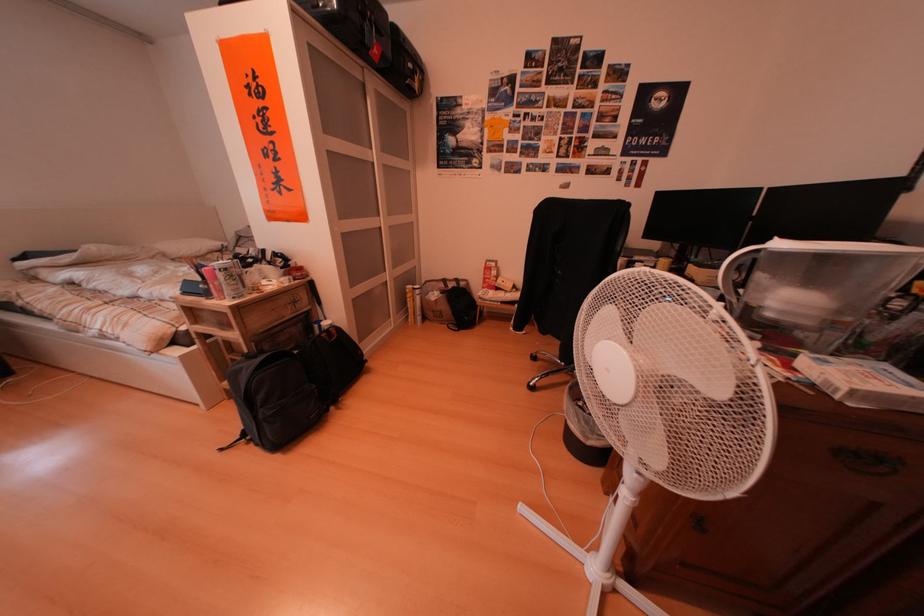
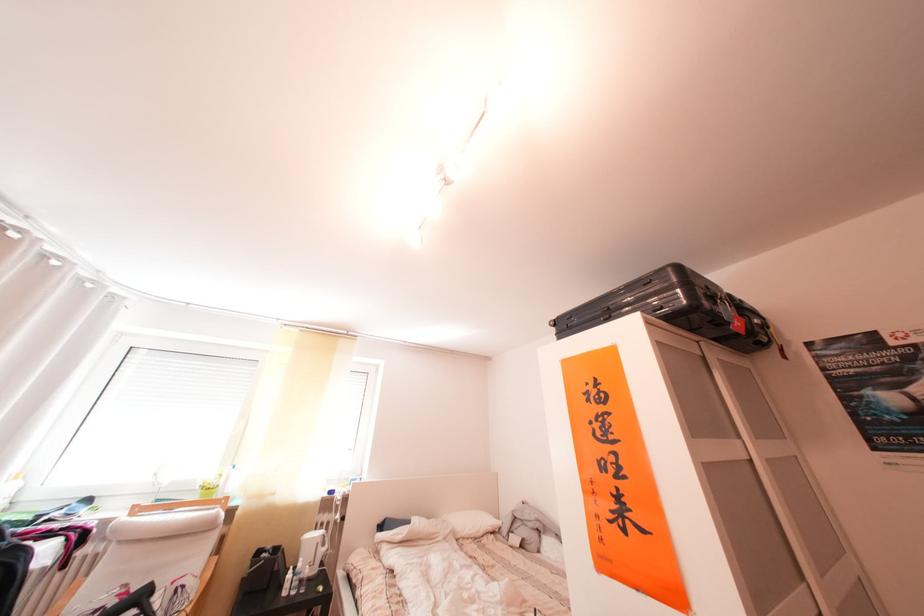
Where in the second image is the point corresponding to (x=367, y=55) from the first image?

(703, 336)